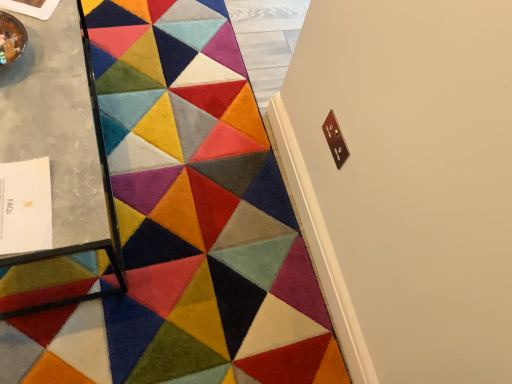
Describe the element at coordinates (61, 143) in the screenshot. I see `metallic glass table at left` at that location.

The image size is (512, 384). Identify the location of metallic glass table at left. (61, 143).

This screenshot has width=512, height=384. In order to click on velvety multicolored rug at center in this screenshot , I will do `click(188, 220)`.

Describe the element at coordinates (188, 220) in the screenshot. Image resolution: width=512 pixels, height=384 pixels. I see `velvety multicolored rug at center` at that location.

I want to click on metallic glass table at left, so click(x=61, y=143).

Is metallic glass table at left to the left of velvety multicolored rug at center from the viewer's perspective?

Correct, you'll find metallic glass table at left to the left of velvety multicolored rug at center.

Looking at this image, is metallic glass table at left further to the viewer compared to velvety multicolored rug at center?

No, it is not.

Does point (37, 76) lie in front of point (318, 342)?

Yes, point (37, 76) is in front of point (318, 342).

From the image's perspective, would you say metallic glass table at left is positioned over velvety multicolored rug at center?

Yes.

From a real-world perspective, who is located lower, metallic glass table at left or velvety multicolored rug at center?

From a 3D spatial view, velvety multicolored rug at center is below.

Does metallic glass table at left have a greater width compared to velvety multicolored rug at center?

Indeed, metallic glass table at left has a greater width compared to velvety multicolored rug at center.

Is metallic glass table at left taller or shorter than velvety multicolored rug at center?

In the image, metallic glass table at left appears to be taller than velvety multicolored rug at center.

Consider the image. Does metallic glass table at left have a larger size compared to velvety multicolored rug at center?

Yes, metallic glass table at left is bigger than velvety multicolored rug at center.

Is metallic glass table at left situated inside velvety multicolored rug at center or outside?

metallic glass table at left exists outside the volume of velvety multicolored rug at center.

Is metallic glass table at left not near velvety multicolored rug at center?

metallic glass table at left is near velvety multicolored rug at center, not far away.

Does metallic glass table at left turn towards velvety multicolored rug at center?

No, metallic glass table at left is not oriented towards velvety multicolored rug at center.

How much distance is there between metallic glass table at left and velvety multicolored rug at center?

metallic glass table at left and velvety multicolored rug at center are 48.19 centimeters apart from each other.

The height and width of the screenshot is (384, 512). What are the coordinates of `table in front of the velvety multicolored rug at center` in the screenshot? It's located at (61, 143).

Is velvety multicolored rug at center to the left or to the right of metallic glass table at left in the image?

In the image, velvety multicolored rug at center appears on the right side of metallic glass table at left.

Which object is further away from the camera, velvety multicolored rug at center or metallic glass table at left?

velvety multicolored rug at center is further away from the camera.

Which is in front, point (103, 57) or point (61, 184)?

The point (61, 184) is closer to the camera.

From the image's perspective, relative to metallic glass table at left, is velvety multicolored rug at center above or below?

velvety multicolored rug at center is below metallic glass table at left.

From a real-world perspective, is velvety multicolored rug at center above or below metallic glass table at left?

From a real-world perspective, velvety multicolored rug at center is physically below metallic glass table at left.

Considering the sizes of objects velvety multicolored rug at center and metallic glass table at left in the image provided, who is wider, velvety multicolored rug at center or metallic glass table at left?

metallic glass table at left is wider.

Is velvety multicolored rug at center taller than metallic glass table at left?

In fact, velvety multicolored rug at center may be shorter than metallic glass table at left.

Can you confirm if velvety multicolored rug at center is bigger than metallic glass table at left?

Incorrect, velvety multicolored rug at center is not larger than metallic glass table at left.

Is velvety multicolored rug at center not within metallic glass table at left?

Yes, velvety multicolored rug at center is not within metallic glass table at left.

Is velvety multicolored rug at center positioned far away from metallic glass table at left?

They are positioned close to each other.

Is velvety multicolored rug at center facing towards metallic glass table at left?

No.

How many degrees apart are the facing directions of velvety multicolored rug at center and metallic glass table at left?

90.8 degrees separate the facing orientations of velvety multicolored rug at center and metallic glass table at left.

Measure the distance between velvety multicolored rug at center and metallic glass table at left.

velvety multicolored rug at center and metallic glass table at left are 18.97 inches apart.

Locate an element on the screen. mat on the right of metallic glass table at left is located at coordinates (188, 220).

Identify the location of mat on the right of metallic glass table at left. (188, 220).

What are the coordinates of `mat that appears behind the metallic glass table at left` in the screenshot? It's located at (188, 220).